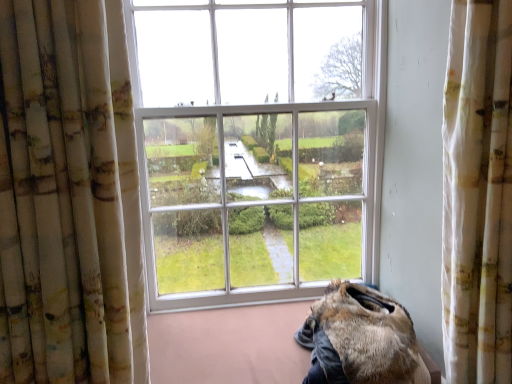
What do you see at coordinates (478, 194) in the screenshot? This screenshot has width=512, height=384. I see `white textured curtain at right, acting as the 1th curtain starting from the right` at bounding box center [478, 194].

You are a GUI agent. You are given a task and a screenshot of the screen. Output one action in this format:
    pyautogui.click(x=<x>, y=<y>)
    Task: Click on the white floral fabric curtain at left, arranged as the 2th curtain when viewed from the right
    This screenshot has height=384, width=512.
    Given the screenshot: What is the action you would take?
    pyautogui.click(x=68, y=197)

The width and height of the screenshot is (512, 384). What are the coordinates of `white textured curtain at right, acting as the 1th curtain starting from the right` in the screenshot? It's located at (478, 194).

Which object is positioned more to the left, fuzzy brown fur at lower right or white floral fabric curtain at left, arranged as the 2th curtain when viewed from the right?

white floral fabric curtain at left, arranged as the 2th curtain when viewed from the right, is more to the left.

Are fuzzy brown fur at lower right and white floral fabric curtain at left, arranged as the 2th curtain when viewed from the right, far apart?

fuzzy brown fur at lower right is near white floral fabric curtain at left, arranged as the 2th curtain when viewed from the right, not far away.

Is fuzzy brown fur at lower right positioned behind white floral fabric curtain at left, arranged as the 2th curtain when viewed from the right?

Yes, fuzzy brown fur at lower right is further from the camera.

From the image's perspective, between fuzzy brown fur at lower right and white floral fabric curtain at left, which is counted as the first curtain, starting from the left, which one is located above?

white floral fabric curtain at left, which is counted as the first curtain, starting from the left, from the image's perspective.

Find the location of a particular element. curtain positioned vertically above the white textured curtain at right, acting as the 1th curtain starting from the right (from a real-world perspective) is located at coordinates (68, 197).

Which object is thinner, white floral fabric curtain at left, arranged as the 2th curtain when viewed from the right, or white textured curtain at right, acting as the 1th curtain starting from the right?

white floral fabric curtain at left, arranged as the 2th curtain when viewed from the right.

Which object is closer to the camera, white floral fabric curtain at left, which is counted as the first curtain, starting from the left, or white textured curtain at right, acting as the 1th curtain starting from the right?

white floral fabric curtain at left, which is counted as the first curtain, starting from the left, is in front.

Could you tell me if white floral fabric curtain at left, which is counted as the first curtain, starting from the left, is turned towards white textured curtain at right, marked as the second curtain in a left-to-right arrangement?

No, white floral fabric curtain at left, which is counted as the first curtain, starting from the left, is not oriented towards white textured curtain at right, marked as the second curtain in a left-to-right arrangement.

Which point is more distant from viewer, [311,342] or [511,41]?

The point [311,342] is more distant.

Is the position of fuzzy brown fur at lower right more distant than that of white textured curtain at right, acting as the 1th curtain starting from the right?

Yes, it is behind white textured curtain at right, acting as the 1th curtain starting from the right.

Between fuzzy brown fur at lower right and white textured curtain at right, acting as the 1th curtain starting from the right, which one has smaller width?

white textured curtain at right, acting as the 1th curtain starting from the right.

Could you tell me if white textured curtain at right, marked as the second curtain in a left-to-right arrangement, is turned towards fuzzy brown fur at lower right?

No, white textured curtain at right, marked as the second curtain in a left-to-right arrangement, is not oriented towards fuzzy brown fur at lower right.

Does white textured curtain at right, marked as the second curtain in a left-to-right arrangement, come in front of fuzzy brown fur at lower right?

Yes.

Can you confirm if white textured curtain at right, marked as the second curtain in a left-to-right arrangement, is thinner than fuzzy brown fur at lower right?

Correct, the width of white textured curtain at right, marked as the second curtain in a left-to-right arrangement, is less than that of fuzzy brown fur at lower right.

Considering the points (510, 245) and (325, 343), which point is behind, point (510, 245) or point (325, 343)?

Positioned behind is point (325, 343).

Is white textured curtain at right, acting as the 1th curtain starting from the right, situated inside white floral fabric curtain at left, arranged as the 2th curtain when viewed from the right, or outside?

The correct answer is: outside.

This screenshot has width=512, height=384. In the image, there is a white floral fabric curtain at left, arranged as the 2th curtain when viewed from the right. In order to click on curtain above it (from the image's perspective) in this screenshot , I will do `click(478, 194)`.

From a real-world perspective, is white textured curtain at right, acting as the 1th curtain starting from the right, under white floral fabric curtain at left, which is counted as the first curtain, starting from the left?

Indeed, from a real-world perspective, white textured curtain at right, acting as the 1th curtain starting from the right, is positioned beneath white floral fabric curtain at left, which is counted as the first curtain, starting from the left.

Between white floral fabric curtain at left, arranged as the 2th curtain when viewed from the right, and fuzzy brown fur at lower right, which one has larger size?

With larger size is white floral fabric curtain at left, arranged as the 2th curtain when viewed from the right.

Does white floral fabric curtain at left, which is counted as the first curtain, starting from the left, turn towards fuzzy brown fur at lower right?

No, white floral fabric curtain at left, which is counted as the first curtain, starting from the left, is not aimed at fuzzy brown fur at lower right.

Which point is more forward, (77, 236) or (341, 369)?

Positioned in front is point (77, 236).

Measure the distance from white floral fabric curtain at left, arranged as the 2th curtain when viewed from the right, to fuzzy brown fur at lower right.

They are 29.61 inches apart.

The image size is (512, 384). Identify the location of curtain lying on the left of fuzzy brown fur at lower right. (68, 197).

The image size is (512, 384). I want to click on curtain located below the white textured curtain at right, marked as the second curtain in a left-to-right arrangement (from the image's perspective), so click(68, 197).

Considering their positions, is fuzzy brown fur at lower right positioned closer to white floral fabric curtain at left, which is counted as the first curtain, starting from the left, than white textured curtain at right, acting as the 1th curtain starting from the right?

fuzzy brown fur at lower right is positioned closer to the anchor white floral fabric curtain at left, which is counted as the first curtain, starting from the left.

Based on the photo, from the image, which object appears to be farther from fuzzy brown fur at lower right, white textured curtain at right, marked as the second curtain in a left-to-right arrangement, or white floral fabric curtain at left, which is counted as the first curtain, starting from the left?

white floral fabric curtain at left, which is counted as the first curtain, starting from the left, is further to fuzzy brown fur at lower right.

Which object lies further to the anchor point fuzzy brown fur at lower right, white floral fabric curtain at left, arranged as the 2th curtain when viewed from the right, or white textured curtain at right, acting as the 1th curtain starting from the right?

white floral fabric curtain at left, arranged as the 2th curtain when viewed from the right, is positioned further to the anchor fuzzy brown fur at lower right.

From the image, which object appears to be farther from white textured curtain at right, acting as the 1th curtain starting from the right, white floral fabric curtain at left, which is counted as the first curtain, starting from the left, or fuzzy brown fur at lower right?

white floral fabric curtain at left, which is counted as the first curtain, starting from the left, lies further to white textured curtain at right, acting as the 1th curtain starting from the right, than the other object.

Estimate the real-world distances between objects in this image. Which object is closer to white textured curtain at right, marked as the second curtain in a left-to-right arrangement, fuzzy brown fur at lower right or white floral fabric curtain at left, which is counted as the first curtain, starting from the left?

Based on the image, fuzzy brown fur at lower right appears to be nearer to white textured curtain at right, marked as the second curtain in a left-to-right arrangement.

Which object lies further to the anchor point white floral fabric curtain at left, which is counted as the first curtain, starting from the left, white textured curtain at right, marked as the second curtain in a left-to-right arrangement, or fuzzy brown fur at lower right?

The object further to white floral fabric curtain at left, which is counted as the first curtain, starting from the left, is white textured curtain at right, marked as the second curtain in a left-to-right arrangement.

The image size is (512, 384). Identify the location of animal situated between white floral fabric curtain at left, arranged as the 2th curtain when viewed from the right, and white textured curtain at right, acting as the 1th curtain starting from the right, from left to right. (361, 339).